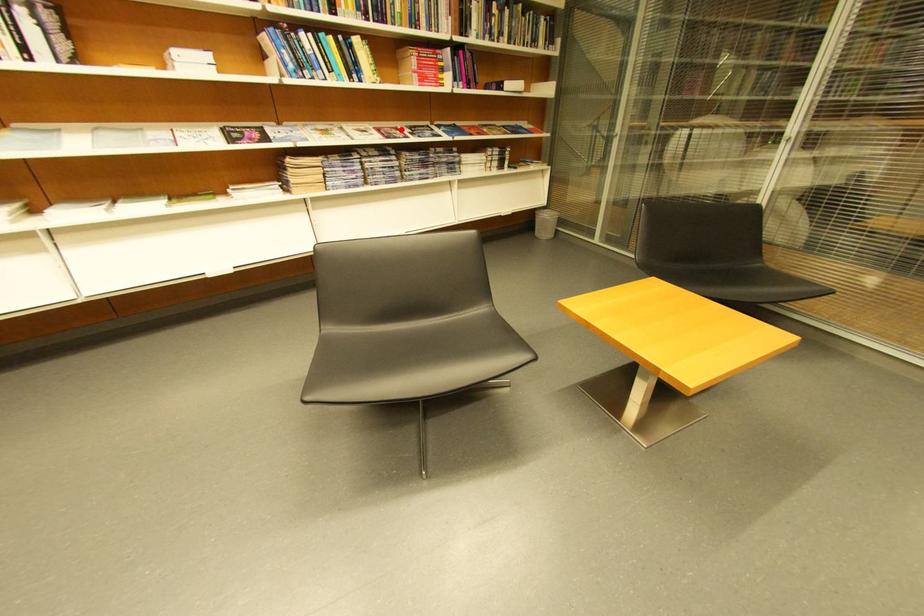
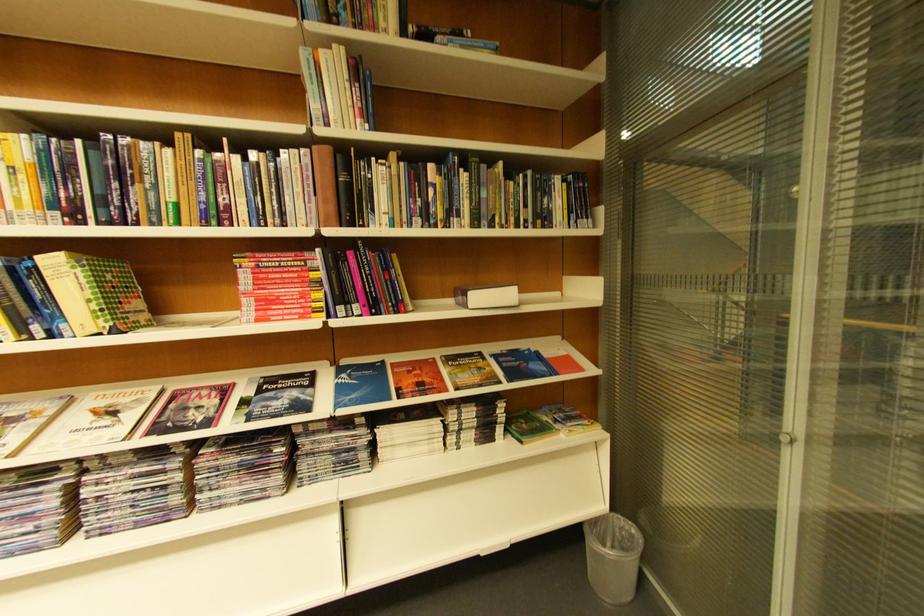
Question: I am providing you with two images of the same scene from different viewpoints. In image1, a red point is highlighted. Considering the same 3D point in image2, which of the following is correct?

Choices:
 (A) It is closer
 (B) It is farther

Answer: (B)